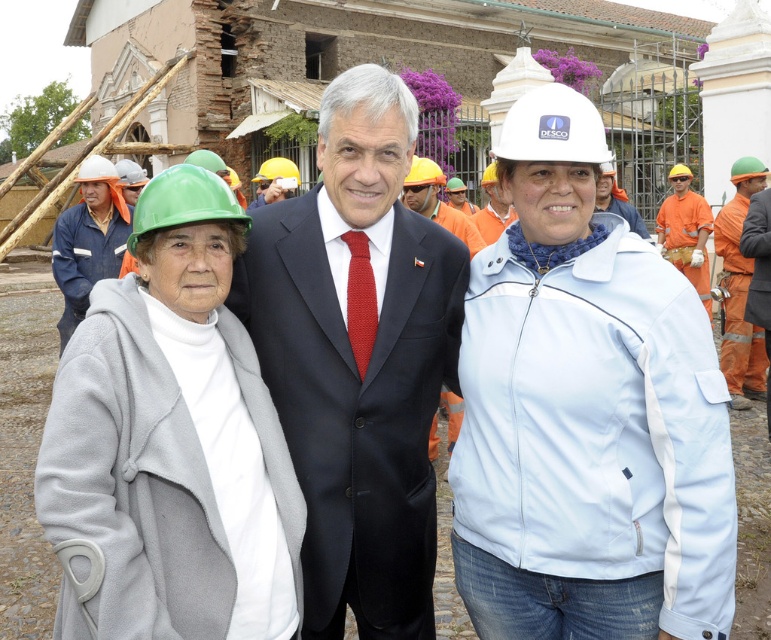
Is point (116, 260) positioned in front of point (702, 244)?

Yes, point (116, 260) is closer to viewer.

Does point (62, 253) lie behind point (706, 289)?

No.

Locate an element on the screen. This screenshot has width=771, height=640. green hard hat at left is located at coordinates (88, 241).

Which of these two, white hard hat at center or orange fabric uniform at center, stands taller?

white hard hat at center is taller.

Which is in front, point (610, 436) or point (753, 176)?

Point (610, 436)

Locate an element on the screen. The image size is (771, 640). white hard hat at center is located at coordinates (586, 413).

Can you confirm if green matte hard hat at left is bigger than orange fabric construction worker at center?

Indeed, green matte hard hat at left has a larger size compared to orange fabric construction worker at center.

Which is in front, point (150, 515) or point (682, 220)?

Point (150, 515) is more forward.

Image resolution: width=771 pixels, height=640 pixels. I want to click on green matte hard hat at left, so click(170, 444).